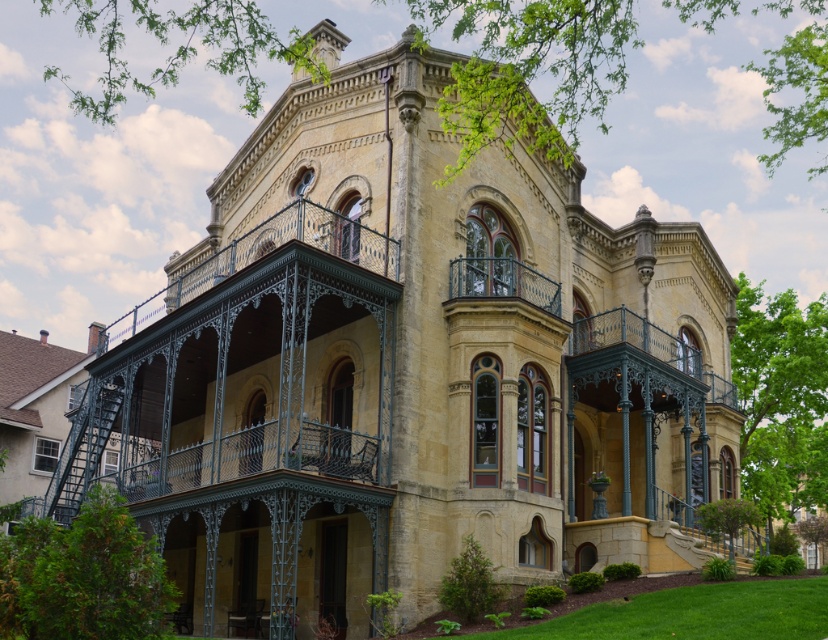
Question: Which object appears farthest from the camera in this image?

Choices:
 (A) polished wrought iron balcony at center
 (B) green wrought iron balcony at center

Answer: (B)

Question: Can you confirm if green wrought iron balcony at center is positioned to the right of polished wrought iron balcony at center?

Choices:
 (A) no
 (B) yes

Answer: (B)

Question: Which point is farther from the camera taking this photo?

Choices:
 (A) (538, 284)
 (B) (720, 396)

Answer: (B)

Question: Is green wrought iron balcony at center bigger than polished wrought iron balcony at center?

Choices:
 (A) no
 (B) yes

Answer: (B)

Question: Can you confirm if green wrought iron balcony at center is smaller than polished wrought iron balcony at center?

Choices:
 (A) no
 (B) yes

Answer: (A)